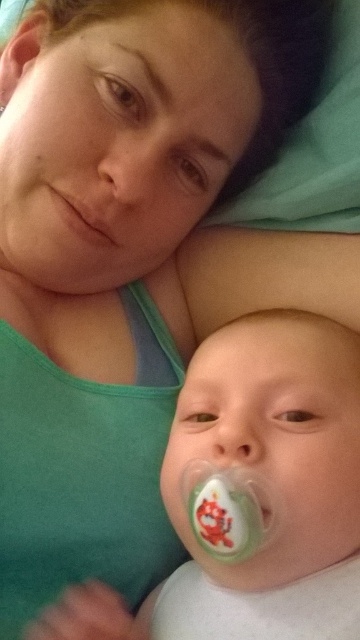
Does white plastic pacifier at lower center appear on the left side of matte pink lips at center?

Incorrect, white plastic pacifier at lower center is not on the left side of matte pink lips at center.

Describe the element at coordinates (251, 493) in the screenshot. Image resolution: width=360 pixels, height=640 pixels. I see `white plastic pacifier at lower center` at that location.

You are a GUI agent. You are given a task and a screenshot of the screen. Output one action in this format:
    pyautogui.click(x=<x>, y=<y>)
    Task: Click on the white plastic pacifier at lower center
    
    Given the screenshot: What is the action you would take?
    pyautogui.click(x=251, y=493)

Is matte pink lips at center positioned behind green rubber teething ring at lower center?

No.

Is matte pink lips at center smaller than green rubber teething ring at lower center?

No, matte pink lips at center is not smaller than green rubber teething ring at lower center.

Who is more distant from viewer, (70, 179) or (0, 108)?

The point (0, 108) is behind.

Locate an element on the screen. The image size is (360, 640). matte pink lips at center is located at coordinates (87, 209).

Which is more to the right, white plastic pacifier at lower center or green rubber teething ring at lower center?

From the viewer's perspective, white plastic pacifier at lower center appears more on the right side.

Does white plastic pacifier at lower center have a larger size compared to green rubber teething ring at lower center?

Yes.

Is point (264, 564) closer to camera compared to point (0, 115)?

That is True.

Identify the location of white plastic pacifier at lower center. (251, 493).